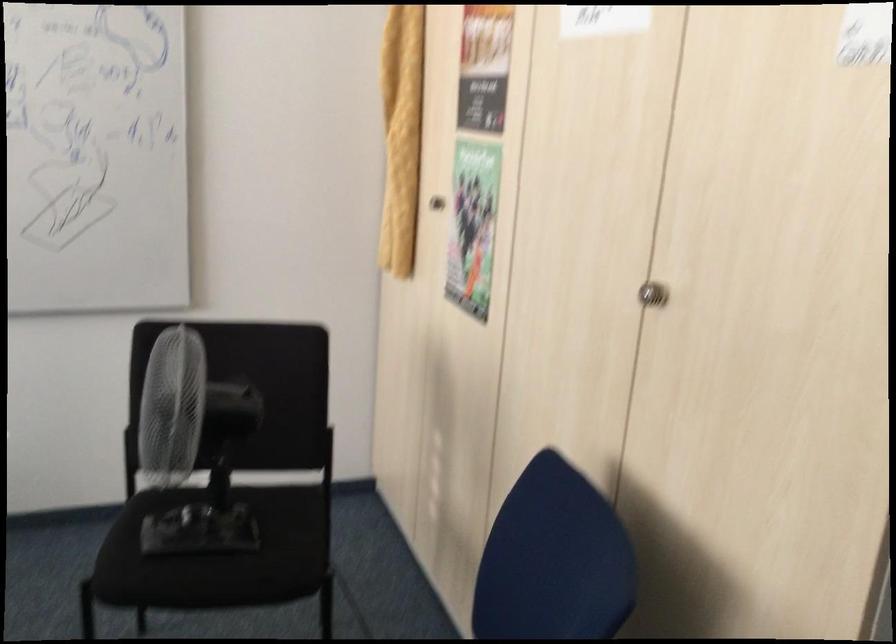
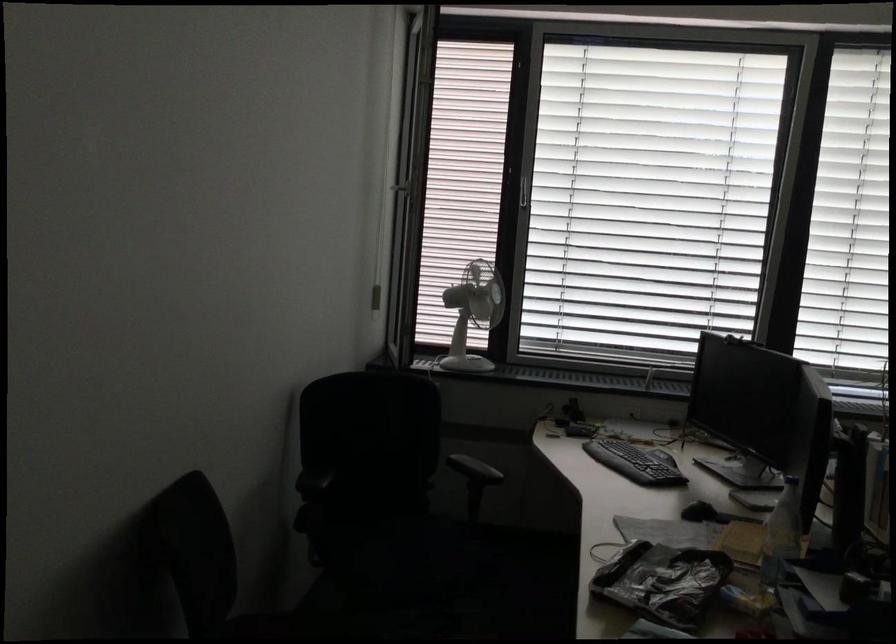
Question: Based on the continuous images, in which direction is the camera rotating? Reply with the corresponding letter.

Choices:
 (A) Left
 (B) Right
 (C) Up
 (D) Down

Answer: (A)